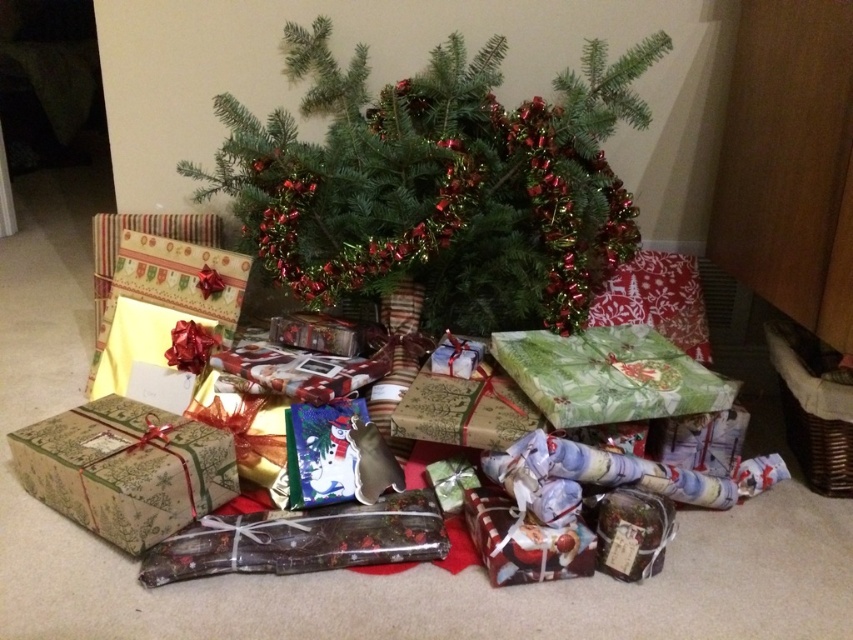
You are standing in the room and want to place a new gift near the green textured christmas tree at center. Where should you place it to ensure it is closest to the tree?

The green textured christmas tree at center is located at point (439, 182), so placing the new gift near those coordinates would ensure it is closest to the tree.

You are a child who just arrived home and sees the green textured christmas tree at center and the shiny metallic wrapping paper at center. Which object is taller?

The green textured christmas tree at center is much taller than the shiny metallic wrapping paper at center.

You are a guest at a Christmas party and want to pick up the matte green paper gift at lower left to see what it is. However, the green textured christmas tree at center is blocking your path. Can you easily reach the gift without moving the tree?

The matte green paper gift at lower left is behind the green textured christmas tree at center, so you cannot easily reach it without moving the tree.